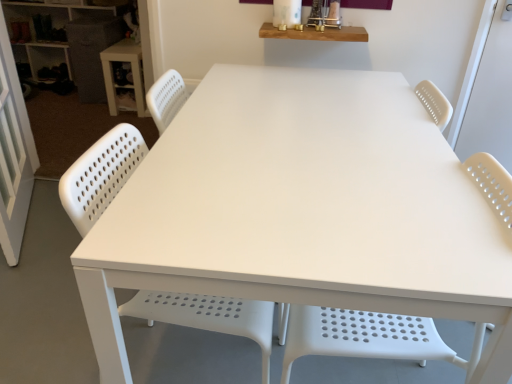
Question: Is white perforated plastic chair at center, the 2th chair in the left-to-right sequence, oriented towards matte white shelves at upper left?

Choices:
 (A) yes
 (B) no

Answer: (B)

Question: From the image's perspective, does white perforated plastic chair at center, which is the 1th chair from right to left, appear higher than matte white shelves at upper left?

Choices:
 (A) yes
 (B) no

Answer: (B)

Question: Can you confirm if white perforated plastic chair at center, the 2th chair in the left-to-right sequence, is positioned to the right of matte white shelves at upper left?

Choices:
 (A) no
 (B) yes

Answer: (B)

Question: Considering the relative sizes of white perforated plastic chair at center, the 2th chair in the left-to-right sequence, and matte white shelves at upper left in the image provided, is white perforated plastic chair at center, the 2th chair in the left-to-right sequence, shorter than matte white shelves at upper left?

Choices:
 (A) yes
 (B) no

Answer: (B)

Question: Is white perforated plastic chair at center, which is the 1th chair from right to left, to the left of matte white shelves at upper left from the viewer's perspective?

Choices:
 (A) no
 (B) yes

Answer: (A)

Question: Is white perforated plastic chair at center, the 2th chair in the left-to-right sequence, bigger than matte white shelves at upper left?

Choices:
 (A) no
 (B) yes

Answer: (A)

Question: Is white plastic table at upper left outside white perforated plastic chair at center, the 2th chair in the left-to-right sequence?

Choices:
 (A) yes
 (B) no

Answer: (A)

Question: Is white plastic table at upper left at the left side of white perforated plastic chair at center, which is the 1th chair from right to left?

Choices:
 (A) yes
 (B) no

Answer: (A)

Question: Considering the relative sizes of white plastic table at upper left and white perforated plastic chair at center, which is the 1th chair from right to left, in the image provided, is white plastic table at upper left shorter than white perforated plastic chair at center, which is the 1th chair from right to left,?

Choices:
 (A) no
 (B) yes

Answer: (B)

Question: Considering the relative sizes of white plastic table at upper left and white perforated plastic chair at center, the 2th chair in the left-to-right sequence, in the image provided, is white plastic table at upper left thinner than white perforated plastic chair at center, the 2th chair in the left-to-right sequence,?

Choices:
 (A) no
 (B) yes

Answer: (B)

Question: Can you confirm if white plastic table at upper left is smaller than white perforated plastic chair at center, the 2th chair in the left-to-right sequence?

Choices:
 (A) no
 (B) yes

Answer: (B)

Question: Considering the relative sizes of white plastic table at upper left and white perforated plastic chair at center, which is the 1th chair from right to left, in the image provided, is white plastic table at upper left bigger than white perforated plastic chair at center, which is the 1th chair from right to left,?

Choices:
 (A) no
 (B) yes

Answer: (A)

Question: Is matte white shelves at upper left thinner than white perforated plastic chair at lower left, the 1th chair from the left?

Choices:
 (A) no
 (B) yes

Answer: (B)